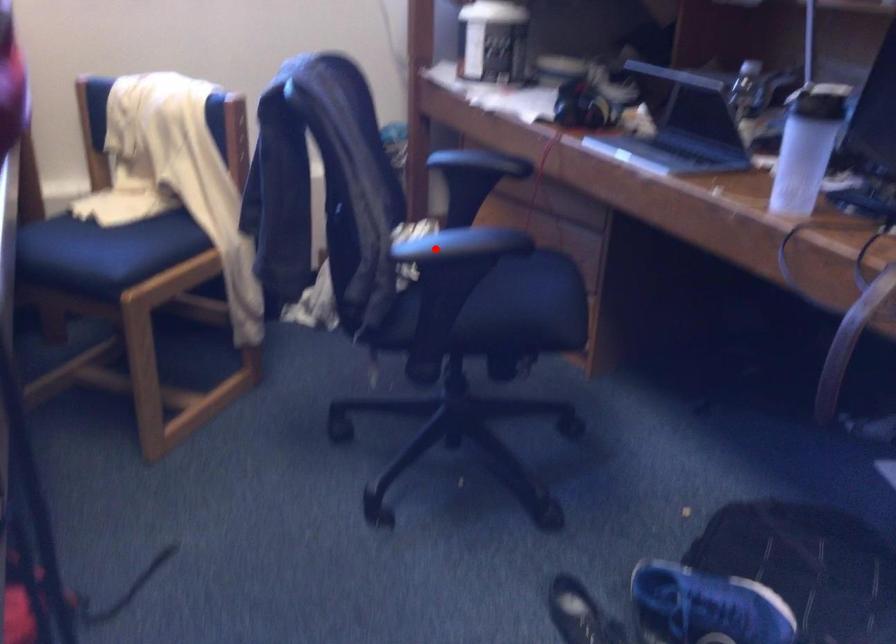
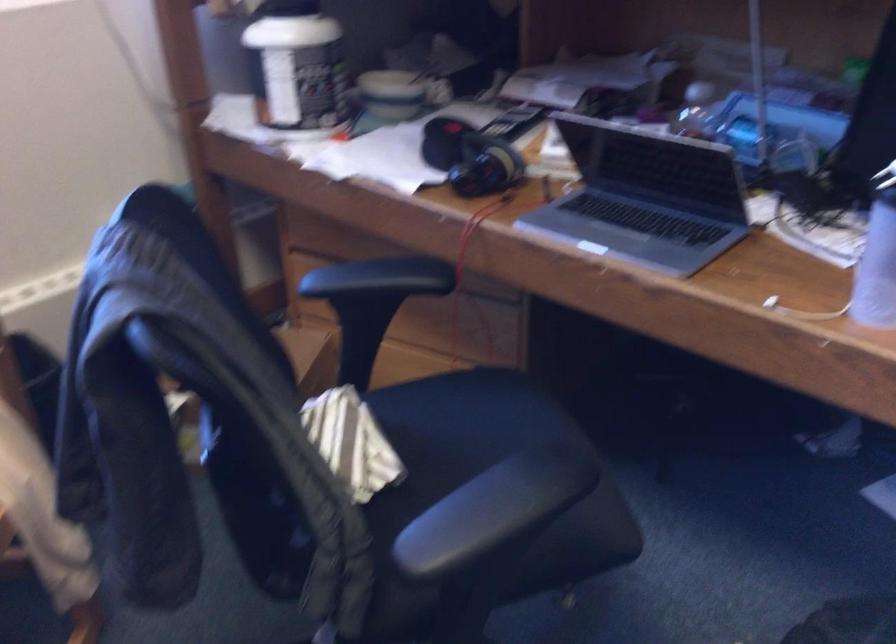
Question: I am providing you with two images of the same scene from different viewpoints. A red point is shown in image1. For the corresponding object point in image2, is it positioned nearer or farther from the camera?

Choices:
 (A) Nearer
 (B) Farther

Answer: (A)